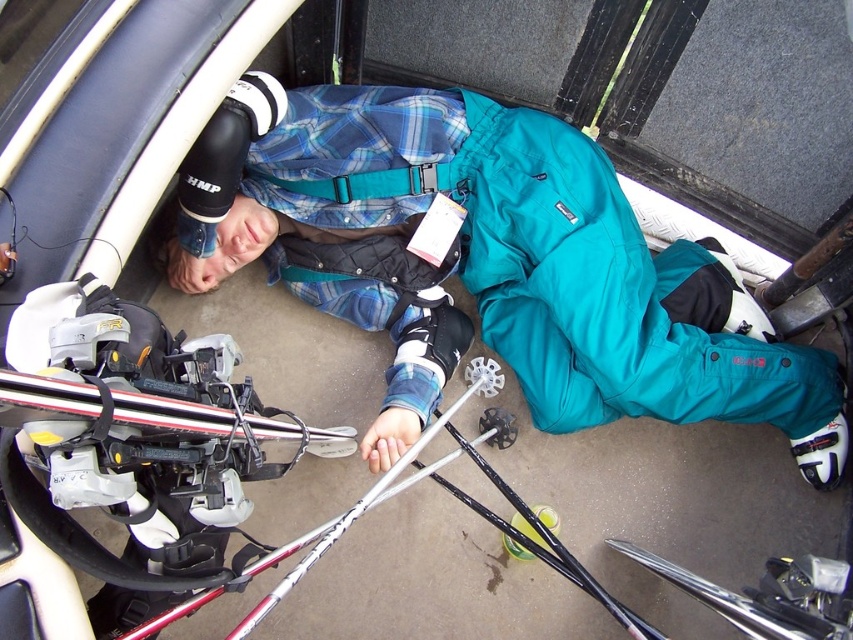
You are a delivery robot trying to locate the teal waterproof suit at center in the cargo area of the vehicle. According to the coordinate system where the bottom left corner is the origin, the point with coordinates (512, 257) is the location of the teal waterproof suit at center. Can you confirm if this coordinate is correct?

Yes, the point at coordinates (512, 257) corresponds to the teal waterproof suit at center, so the coordinate is correct.

You are a photographer trying to capture the best angle of the person in the vehicle. You have two points marked on your camera screen at coordinates point (216,170) and point (260,177). Which point is closer to you?

Point (216,170) is closer to the viewer than point (260,177).